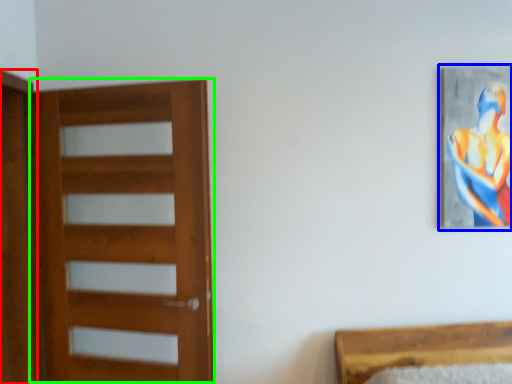
Question: Which object is positioned farthest from screen door (highlighted by a red box)? Select from picture frame (highlighted by a blue box) and door (highlighted by a green box).

Choices:
 (A) picture frame
 (B) door

Answer: (A)